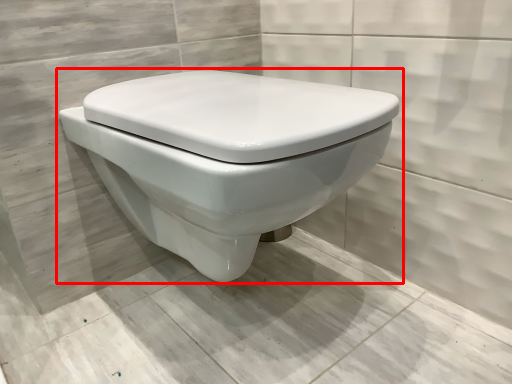
Question: From the image's perspective, where is toilet (annotated by the red box) located relative to concrete?

Choices:
 (A) below
 (B) above

Answer: (B)